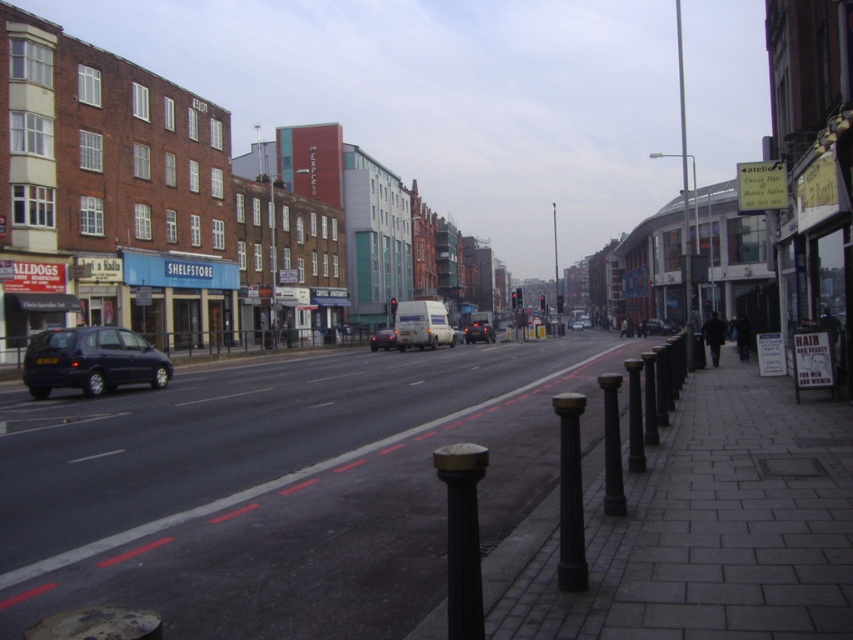
Question: Which point is closer to the camera?

Choices:
 (A) (573, 323)
 (B) (556, 237)
 (C) (140, 374)
 (D) (468, 499)

Answer: (D)

Question: Which object is positioned closest to the metallic pole at right?

Choices:
 (A) black concrete pavement at lower right
 (B) matte white van at center

Answer: (A)

Question: Can you confirm if black concrete pavement at lower right is positioned above white matte van at center?

Choices:
 (A) no
 (B) yes

Answer: (A)

Question: Which object is farther from the camera taking this photo?

Choices:
 (A) black matte pole at lower center
 (B) metallic pole at right

Answer: (B)

Question: Considering the relative positions of matte dark blue van at left and metallic pole at right in the image provided, where is matte dark blue van at left located with respect to metallic pole at right?

Choices:
 (A) below
 (B) above

Answer: (A)

Question: Considering the relative positions of white matte van at center and matte black van at center in the image provided, where is white matte van at center located with respect to matte black van at center?

Choices:
 (A) left
 (B) right

Answer: (A)